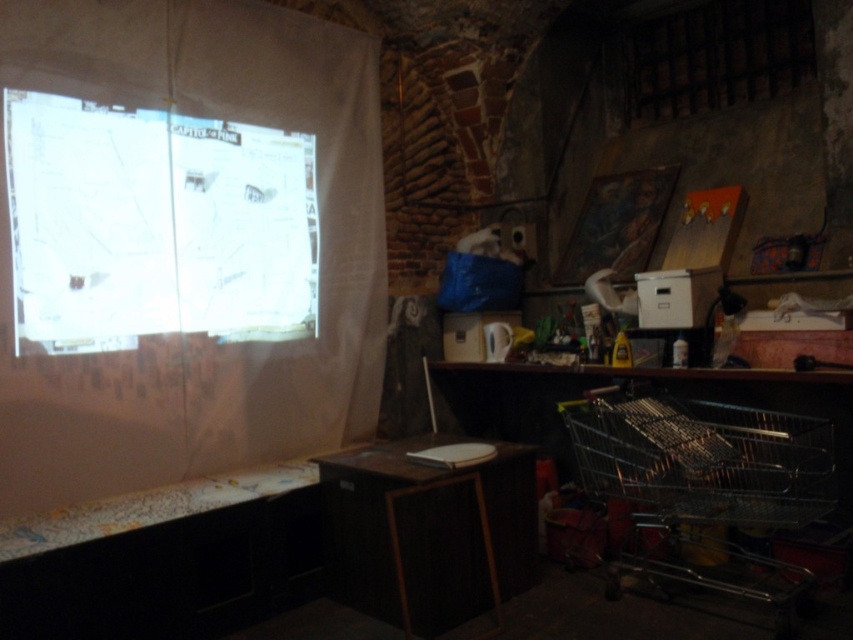
Between metallic wire shopping cart at lower right and wooden table at center, which one is positioned higher?

Positioned higher is metallic wire shopping cart at lower right.

Does metallic wire shopping cart at lower right have a smaller size compared to wooden table at center?

Actually, metallic wire shopping cart at lower right might be larger than wooden table at center.

Where is `metallic wire shopping cart at lower right`? The width and height of the screenshot is (853, 640). metallic wire shopping cart at lower right is located at coordinates (704, 481).

You are a GUI agent. You are given a task and a screenshot of the screen. Output one action in this format:
    pyautogui.click(x=<x>, y=<y>)
    Task: Click on the metallic wire shopping cart at lower right
    The height and width of the screenshot is (640, 853).
    Given the screenshot: What is the action you would take?
    pyautogui.click(x=704, y=481)

From the picture: Can you confirm if white fabric curtain at left is thinner than wooden table at center?

No.

Who is more distant from viewer, (x=361, y=288) or (x=416, y=598)?

The point (x=361, y=288) is behind.

Locate an element on the screen. The height and width of the screenshot is (640, 853). white fabric curtain at left is located at coordinates (183, 243).

Can you confirm if white fabric curtain at left is smaller than white paper at upper left?

No, white fabric curtain at left is not smaller than white paper at upper left.

Is white fabric curtain at left bigger than white paper at upper left?

Indeed, white fabric curtain at left has a larger size compared to white paper at upper left.

Where is `white fabric curtain at left`? The height and width of the screenshot is (640, 853). white fabric curtain at left is located at coordinates (183, 243).